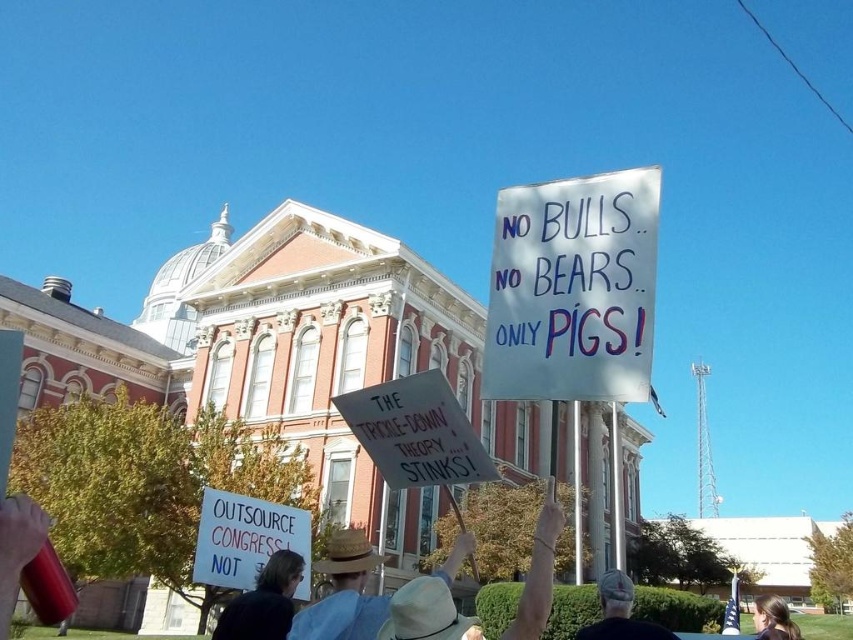
Who is positioned more to the left, straw hat at center or dark brown leather jacket at lower center?

Positioned to the left is dark brown leather jacket at lower center.

Does point (332, 588) come in front of point (291, 620)?

No.

Who is more forward, (372, 564) or (288, 589)?

Point (372, 564) is in front.

The image size is (853, 640). Identify the location of straw hat at center. (343, 593).

Describe the element at coordinates (263, 602) in the screenshot. I see `dark brown leather jacket at lower center` at that location.

Which is in front, point (287, 625) or point (613, 580)?

Point (287, 625) is more forward.

This screenshot has width=853, height=640. I want to click on dark brown leather jacket at lower center, so click(263, 602).

Does denim cap at center appear on the right side of smooth brown hair at center?

Incorrect, denim cap at center is not on the right side of smooth brown hair at center.

Is denim cap at center positioned at the back of smooth brown hair at center?

No, denim cap at center is closer to the viewer.

Who is more distant from viewer, (x=604, y=616) or (x=772, y=609)?

Point (x=772, y=609)

Identify the location of denim cap at center. (619, 612).